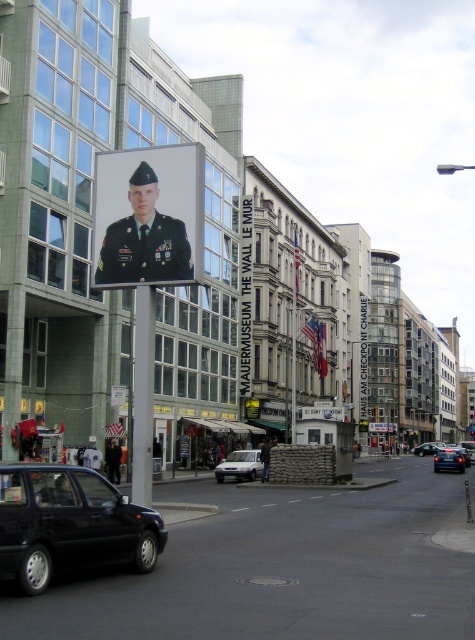
Does point (101, 540) come farther from viewer compared to point (449, 451)?

No.

Is shiny black car at lower left smaller than shiny black sedan at lower right?

Yes, shiny black car at lower left is smaller than shiny black sedan at lower right.

What do you see at coordinates (69, 524) in the screenshot? The image size is (475, 640). I see `shiny black car at lower left` at bounding box center [69, 524].

In order to click on shiny black car at lower left in this screenshot , I will do `click(69, 524)`.

Is white matte van at center above blue metallic sedan at center?

Correct, white matte van at center is located above blue metallic sedan at center.

Is point (256, 454) behind point (431, 445)?

No, (256, 454) is in front of (431, 445).

Is point (245, 460) positioned before point (427, 444)?

Yes.

At what (x,y) coordinates should I click in order to perform the action: click on white matte van at center. Please return your answer as a coordinate pair (x, y). The image size is (475, 640). Looking at the image, I should click on (239, 465).

Is metallic pole at center above shiny black sedan at lower right?

Yes, metallic pole at center is above shiny black sedan at lower right.

In order to click on metallic pole at center in this screenshot , I will do [x=142, y=394].